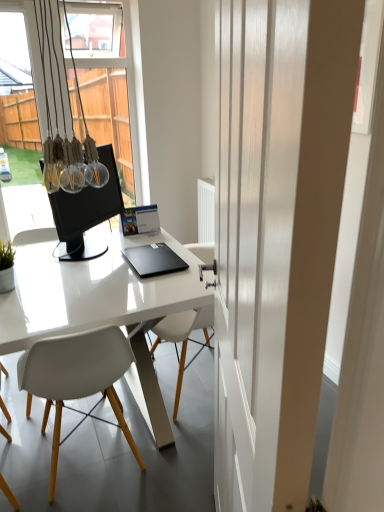
Question: From a real-world perspective, is matte black monitor at center located beneath white glossy door at center?

Choices:
 (A) yes
 (B) no

Answer: (B)

Question: Is the position of matte black monitor at center less distant than that of white glossy door at center?

Choices:
 (A) yes
 (B) no

Answer: (B)

Question: From the image's perspective, would you say matte black monitor at center is shown under white glossy door at center?

Choices:
 (A) no
 (B) yes

Answer: (A)

Question: Is matte black monitor at center taller than white glossy door at center?

Choices:
 (A) yes
 (B) no

Answer: (B)

Question: Can white glossy door at center be found inside matte black monitor at center?

Choices:
 (A) yes
 (B) no

Answer: (B)

Question: Is black matte laptop at center inside or outside of white glossy door at center?

Choices:
 (A) outside
 (B) inside

Answer: (A)

Question: From a real-world perspective, is black matte laptop at center positioned above or below white glossy door at center?

Choices:
 (A) below
 (B) above

Answer: (A)

Question: Is point (145, 259) positioned closer to the camera than point (281, 237)?

Choices:
 (A) farther
 (B) closer

Answer: (A)

Question: Based on their positions, is black matte laptop at center located to the left or right of white glossy door at center?

Choices:
 (A) right
 (B) left

Answer: (B)

Question: Considering the positions of translucent glass light fixture at upper left and white plastic chair at center in the image, is translucent glass light fixture at upper left taller or shorter than white plastic chair at center?

Choices:
 (A) short
 (B) tall

Answer: (B)

Question: From a real-world perspective, is translucent glass light fixture at upper left positioned above or below white plastic chair at center?

Choices:
 (A) above
 (B) below

Answer: (A)

Question: Is translucent glass light fixture at upper left inside the boundaries of white plastic chair at center, or outside?

Choices:
 (A) outside
 (B) inside

Answer: (A)

Question: From the image's perspective, relative to white plastic chair at center, is translucent glass light fixture at upper left above or below?

Choices:
 (A) above
 (B) below

Answer: (A)

Question: Based on their sizes in the image, would you say translucent glass light fixture at upper left is bigger or smaller than black matte laptop at center?

Choices:
 (A) small
 (B) big

Answer: (B)

Question: From a real-world perspective, is translucent glass light fixture at upper left physically located above or below black matte laptop at center?

Choices:
 (A) above
 (B) below

Answer: (A)